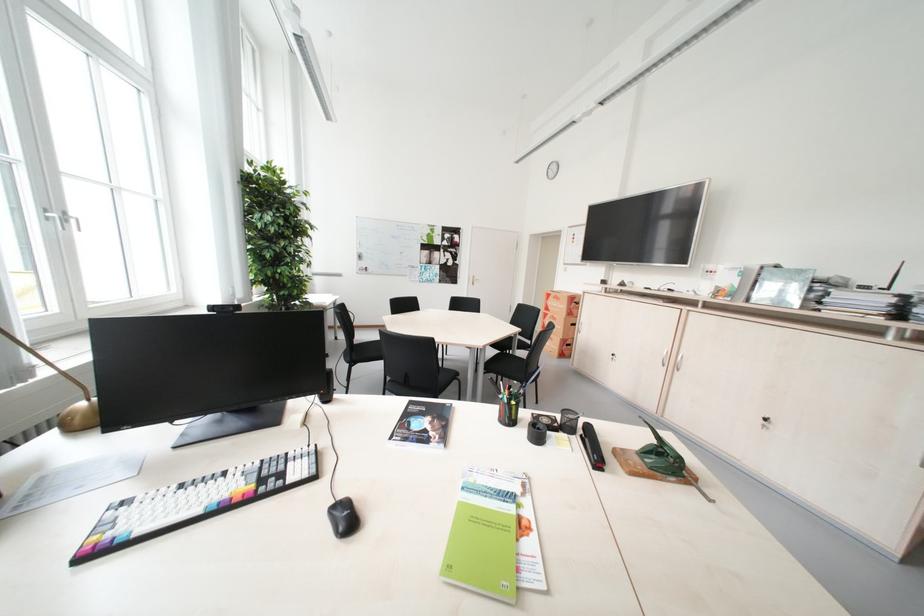
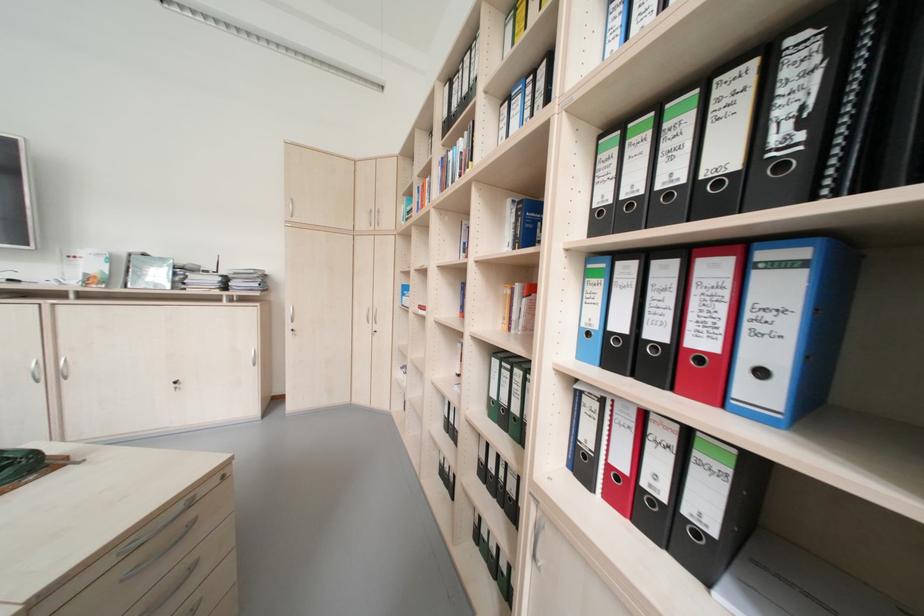
Question: How did the camera likely rotate?

Choices:
 (A) Left
 (B) Right
 (C) Up
 (D) Down

Answer: (B)